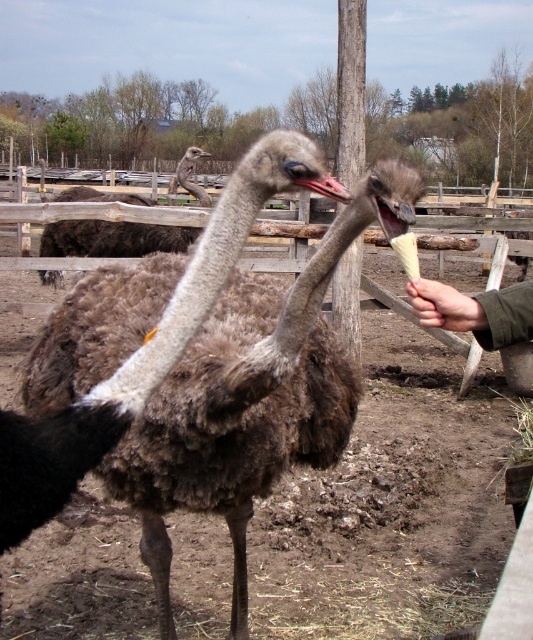
Can you confirm if brown fuzzy ostrich at center is shorter than smooth skin hand at center?

In fact, brown fuzzy ostrich at center may be taller than smooth skin hand at center.

Is brown fuzzy ostrich at center above smooth skin hand at center?

No.

Image resolution: width=533 pixels, height=640 pixels. I want to click on brown fuzzy ostrich at center, so click(x=251, y=396).

Between point (124, 244) and point (424, 285), which one is positioned in front?

Positioned in front is point (424, 285).

Identify the location of brown fuzzy ostrich at upper center. (112, 237).

Can you confirm if brown fuzzy ostrich at center is bigger than brown fuzzy ostrich at upper center?

No.

Is point (139, 314) more distant than point (123, 196)?

No.

Where is `brown fuzzy ostrich at center`? The width and height of the screenshot is (533, 640). brown fuzzy ostrich at center is located at coordinates [x=251, y=396].